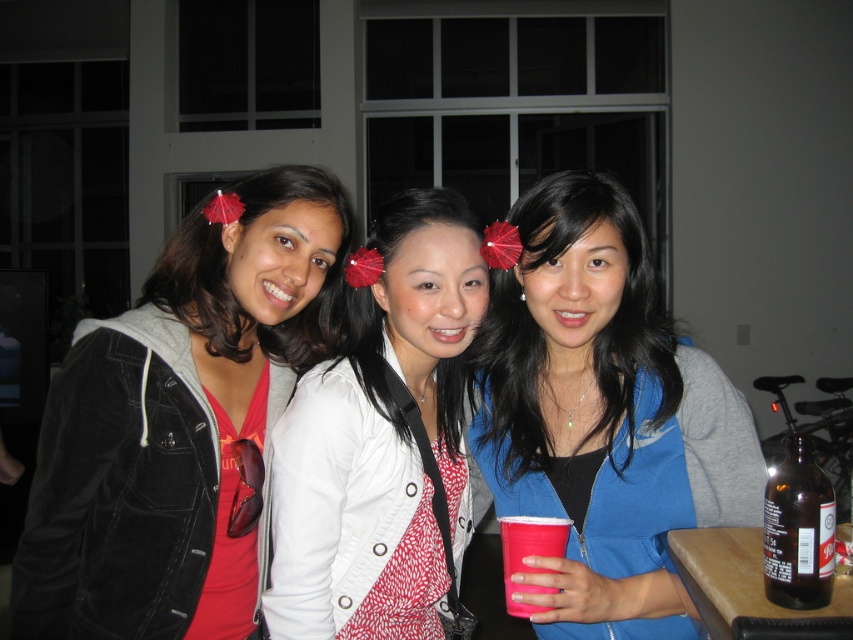
You are standing at the camera position and want to place a small decoration at point (322,394). If your arm reaches 3.5 feet, can you reach that point?

The distance of point (322,394) from camera is 3.70 feet, so you cannot reach it with an arm that only extends 3.5 feet.

You are a photographer trying to capture the woman in the white jacket at center. The camera is set to focus on the point at coordinates point (x=380, y=440). Will the woman in the white jacket at center be in focus?

Yes, the white textured jacket at center is located at point (x=380, y=440), so the camera will focus on the woman in the white jacket at center.